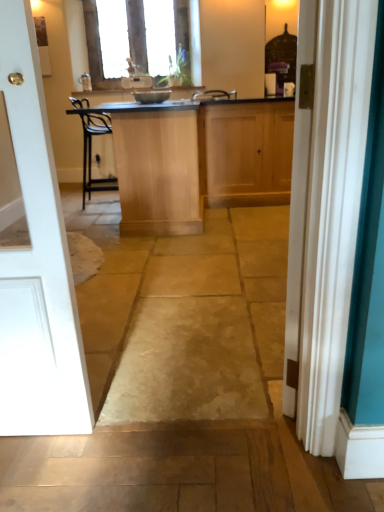
Question: Should I look upward or downward to see wooden cabinet at center, which is counted as the 1th cabinetry, starting from the right?

Choices:
 (A) up
 (B) down

Answer: (A)

Question: From the image's perspective, is metallic silver bowl at center beneath white painted wood door at left?

Choices:
 (A) no
 (B) yes

Answer: (A)

Question: Does metallic silver bowl at center lie behind white painted wood door at left?

Choices:
 (A) yes
 (B) no

Answer: (A)

Question: Can you confirm if metallic silver bowl at center is bigger than white painted wood door at left?

Choices:
 (A) no
 (B) yes

Answer: (A)

Question: Does metallic silver bowl at center appear on the right side of white painted wood door at left?

Choices:
 (A) yes
 (B) no

Answer: (A)

Question: Is metallic silver bowl at center facing towards white painted wood door at left?

Choices:
 (A) yes
 (B) no

Answer: (B)

Question: Considering the relative sizes of metallic silver bowl at center and white painted wood door at left in the image provided, is metallic silver bowl at center smaller than white painted wood door at left?

Choices:
 (A) no
 (B) yes

Answer: (B)

Question: From the image's perspective, would you say light wood/finely finished cabinet at center, the first cabinetry from the left, is positioned over teal fabric curtain at right?

Choices:
 (A) yes
 (B) no

Answer: (A)

Question: Is light wood/finely finished cabinet at center, the first cabinetry from the left, far away from teal fabric curtain at right?

Choices:
 (A) yes
 (B) no

Answer: (A)

Question: Is light wood/finely finished cabinet at center, placed as the second cabinetry when sorted from right to left, not inside teal fabric curtain at right?

Choices:
 (A) yes
 (B) no

Answer: (A)

Question: Is light wood/finely finished cabinet at center, the first cabinetry from the left, shorter than teal fabric curtain at right?

Choices:
 (A) yes
 (B) no

Answer: (A)

Question: From a real-world perspective, is light wood/finely finished cabinet at center, placed as the second cabinetry when sorted from right to left, below teal fabric curtain at right?

Choices:
 (A) no
 (B) yes

Answer: (B)

Question: Are light wood/finely finished cabinet at center, placed as the second cabinetry when sorted from right to left, and teal fabric curtain at right making contact?

Choices:
 (A) no
 (B) yes

Answer: (A)

Question: Does wooden cabinet at center, which is counted as the 1th cabinetry, starting from the right, have a lesser height compared to light wood/finely finished cabinet at center, placed as the second cabinetry when sorted from right to left?

Choices:
 (A) yes
 (B) no

Answer: (A)